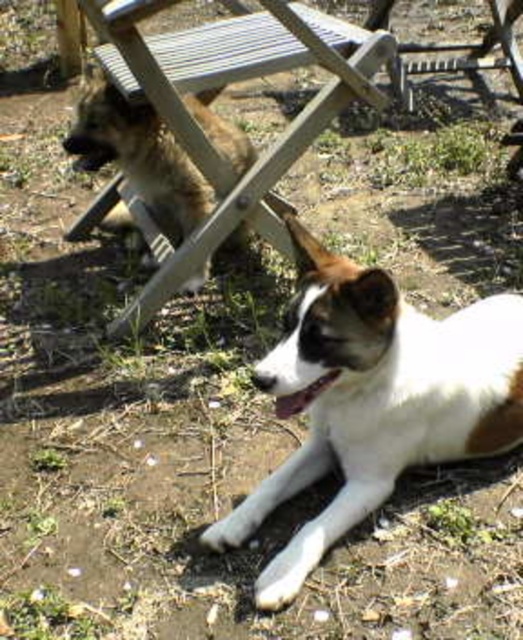
Between point (509, 416) and point (374, 93), which one is positioned in front?

Point (509, 416) is more forward.

Describe the element at coordinates (373, 397) in the screenshot. Image resolution: width=523 pixels, height=640 pixels. I see `white fur dog at lower right` at that location.

Is point (392, 445) in front of point (150, 10)?

Yes, it is.

Where is `white fur dog at lower right`? Image resolution: width=523 pixels, height=640 pixels. white fur dog at lower right is located at coordinates (373, 397).